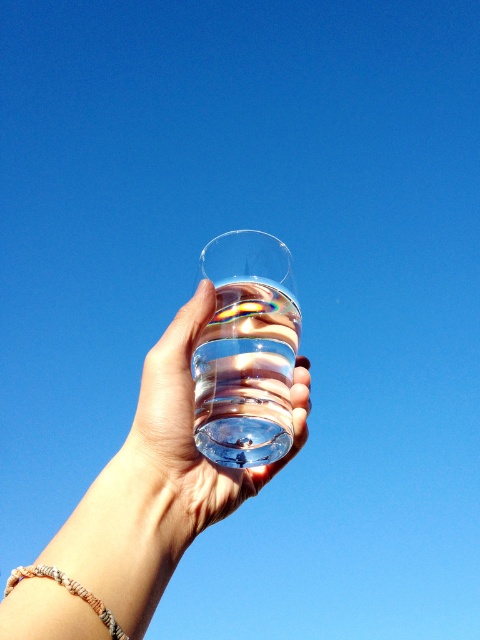
You are a photographer trying to capture the reflection of the sky in the transparent glass at center. To do this, you need to ensure the glass is positioned correctly relative to the beige woven bracelet at lower left. Which object should be closer to the camera to achieve the best reflection?

The transparent glass at center should be closer to the camera than the beige woven bracelet at lower left to ensure the reflection of the sky is captured clearly.